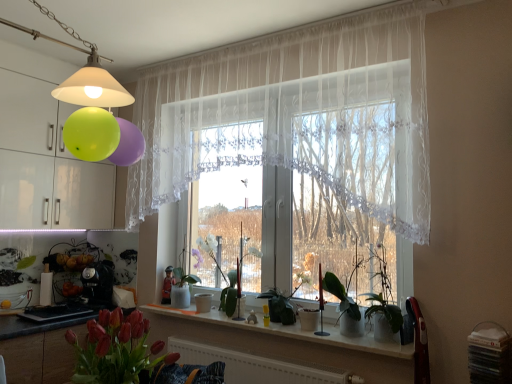
Question: Is green matte plant at center, the second plant positioned from the back, bigger than white glossy window sill at center?

Choices:
 (A) no
 (B) yes

Answer: (B)

Question: Considering the relative sizes of green matte plant at center, the second plant from the front, and white glossy window sill at center in the image provided, is green matte plant at center, the second plant from the front, smaller than white glossy window sill at center?

Choices:
 (A) no
 (B) yes

Answer: (A)

Question: Is green matte plant at center, marked as the 2th plant in a left-to-right arrangement, looking in the opposite direction of white glossy window sill at center?

Choices:
 (A) no
 (B) yes

Answer: (A)

Question: Is green matte plant at center, the second plant positioned from the back, to the right of white glossy window sill at center from the viewer's perspective?

Choices:
 (A) no
 (B) yes

Answer: (B)

Question: From a real-world perspective, is green matte plant at center, the second plant from the front, positioned under white glossy window sill at center based on gravity?

Choices:
 (A) yes
 (B) no

Answer: (B)

Question: From a real-world perspective, relative to white matte radiator at lower center, is white lace curtain at center vertically above or below?

Choices:
 (A) above
 (B) below

Answer: (A)

Question: Is white lace curtain at center taller or shorter than white matte radiator at lower center?

Choices:
 (A) short
 (B) tall

Answer: (B)

Question: Is point (339, 259) closer or farther from the camera than point (286, 360)?

Choices:
 (A) farther
 (B) closer

Answer: (B)

Question: From the image's perspective, relative to white matte radiator at lower center, is white lace curtain at center above or below?

Choices:
 (A) below
 (B) above

Answer: (B)

Question: Is green matte plant at center, marked as the 3th plant in a left-to-right arrangement, wider or thinner than white glossy vase at center, which is the 3th plant in right-to-left order?

Choices:
 (A) wide
 (B) thin

Answer: (B)

Question: Considering the positions of green matte plant at center, marked as the 3th plant in a left-to-right arrangement, and white glossy vase at center, which is the 3th plant in right-to-left order, in the image, is green matte plant at center, marked as the 3th plant in a left-to-right arrangement, taller or shorter than white glossy vase at center, which is the 3th plant in right-to-left order,?

Choices:
 (A) short
 (B) tall

Answer: (B)

Question: Choose the correct answer: Is green matte plant at center, marked as the 3th plant in a left-to-right arrangement, inside white glossy vase at center, acting as the third plant starting from the front, or outside it?

Choices:
 (A) inside
 (B) outside

Answer: (B)

Question: Looking at the image, does green matte plant at center, placed as the 1th plant when sorted from right to left, seem bigger or smaller compared to white glossy vase at center, the 1th plant when ordered from left to right?

Choices:
 (A) big
 (B) small

Answer: (B)

Question: From a real-world perspective, is white glossy vase at center, acting as the third plant starting from the front, positioned above or below white lace curtain at center?

Choices:
 (A) below
 (B) above

Answer: (A)

Question: Is white glossy vase at center, which is counted as the 1th plant, starting from the back, spatially inside white lace curtain at center, or outside of it?

Choices:
 (A) outside
 (B) inside

Answer: (B)